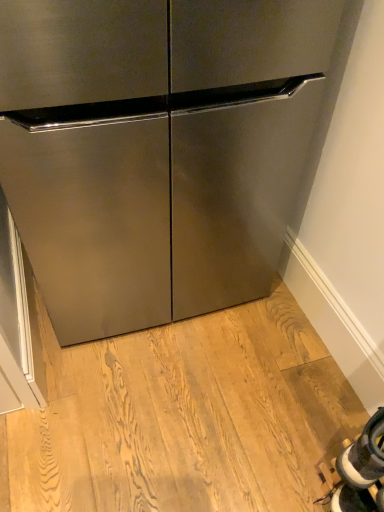
Question: Is stainless steel refrigerator at center at the left side of white fabric shoe at lower right?

Choices:
 (A) yes
 (B) no

Answer: (A)

Question: From a real-world perspective, is stainless steel refrigerator at center positioned over white fabric shoe at lower right based on gravity?

Choices:
 (A) no
 (B) yes

Answer: (B)

Question: Is stainless steel refrigerator at center smaller than white fabric shoe at lower right?

Choices:
 (A) yes
 (B) no

Answer: (B)

Question: Is stainless steel refrigerator at center outside of white fabric shoe at lower right?

Choices:
 (A) yes
 (B) no

Answer: (A)

Question: Is stainless steel refrigerator at center behind white fabric shoe at lower right?

Choices:
 (A) yes
 (B) no

Answer: (B)

Question: From the image's perspective, is stainless steel refrigerator at center located beneath white fabric shoe at lower right?

Choices:
 (A) no
 (B) yes

Answer: (A)

Question: Does white fabric shoe at lower right lie behind stainless steel refrigerator at center?

Choices:
 (A) yes
 (B) no

Answer: (A)

Question: From a real-world perspective, is white fabric shoe at lower right positioned under stainless steel refrigerator at center based on gravity?

Choices:
 (A) yes
 (B) no

Answer: (A)

Question: Is white fabric shoe at lower right facing towards stainless steel refrigerator at center?

Choices:
 (A) no
 (B) yes

Answer: (A)

Question: Can you confirm if white fabric shoe at lower right is smaller than stainless steel refrigerator at center?

Choices:
 (A) no
 (B) yes

Answer: (B)

Question: From the image's perspective, is white fabric shoe at lower right over stainless steel refrigerator at center?

Choices:
 (A) yes
 (B) no

Answer: (B)

Question: Does white fabric shoe at lower right have a larger size compared to stainless steel refrigerator at center?

Choices:
 (A) no
 (B) yes

Answer: (A)

Question: Considering the positions of point coord(183,243) and point coord(382,415), is point coord(183,243) closer or farther from the camera than point coord(382,415)?

Choices:
 (A) closer
 (B) farther

Answer: (B)